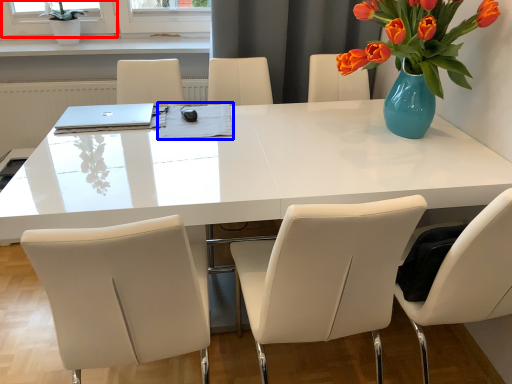
Question: Among these objects, which one is nearest to the camera, window screen (highlighted by a red box) or notepad (highlighted by a blue box)?

Choices:
 (A) window screen
 (B) notepad

Answer: (B)